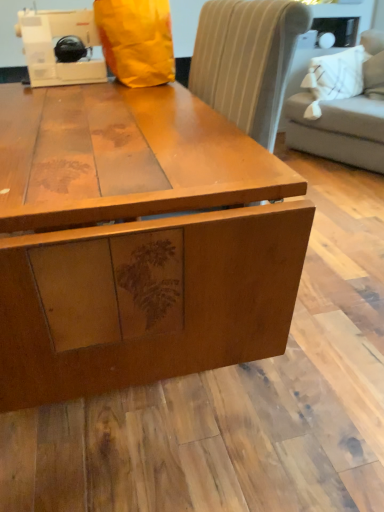
Question: From the image's perspective, is matte wood table at center below white plastic sewing machine at upper left?

Choices:
 (A) yes
 (B) no

Answer: (A)

Question: Can you confirm if matte wood table at center is positioned to the right of white plastic sewing machine at upper left?

Choices:
 (A) no
 (B) yes

Answer: (B)

Question: Would you say matte wood table at center is outside white plastic sewing machine at upper left?

Choices:
 (A) no
 (B) yes

Answer: (B)

Question: Considering the relative sizes of matte wood table at center and white plastic sewing machine at upper left in the image provided, is matte wood table at center thinner than white plastic sewing machine at upper left?

Choices:
 (A) no
 (B) yes

Answer: (A)

Question: Can you confirm if matte wood table at center is smaller than white plastic sewing machine at upper left?

Choices:
 (A) no
 (B) yes

Answer: (A)

Question: Could you tell me if matte wood table at center is facing white plastic sewing machine at upper left?

Choices:
 (A) no
 (B) yes

Answer: (A)

Question: Can we say matte wood table at center lies outside light gray fabric couch at upper right?

Choices:
 (A) yes
 (B) no

Answer: (A)

Question: Can you confirm if matte wood table at center is bigger than light gray fabric couch at upper right?

Choices:
 (A) yes
 (B) no

Answer: (B)

Question: Is the surface of matte wood table at center in direct contact with light gray fabric couch at upper right?

Choices:
 (A) no
 (B) yes

Answer: (A)

Question: Is light gray fabric couch at upper right a part of matte wood table at center?

Choices:
 (A) yes
 (B) no

Answer: (B)

Question: From a real-world perspective, is matte wood table at center under light gray fabric couch at upper right?

Choices:
 (A) no
 (B) yes

Answer: (B)

Question: Considering the relative sizes of matte wood table at center and light gray fabric couch at upper right in the image provided, is matte wood table at center wider than light gray fabric couch at upper right?

Choices:
 (A) no
 (B) yes

Answer: (B)

Question: Does light gray fabric couch at upper right appear on the right side of matte wood table at center?

Choices:
 (A) no
 (B) yes

Answer: (B)